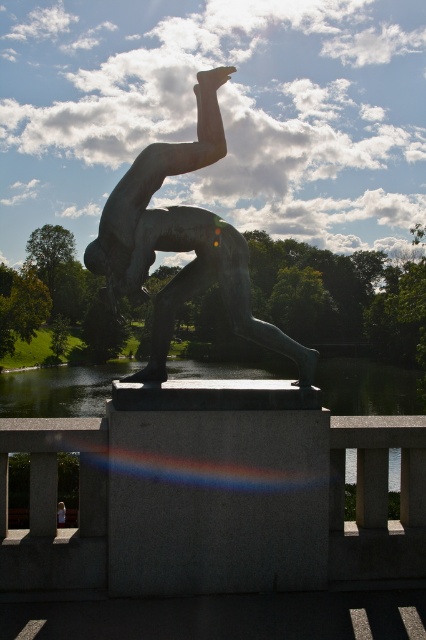
Question: Does bronze statue at center have a smaller size compared to transparent glass water at center?

Choices:
 (A) no
 (B) yes

Answer: (B)

Question: Which object appears closest to the camera in this image?

Choices:
 (A) bronze statue at center
 (B) transparent glass water at center

Answer: (A)

Question: Among these points, which one is nearest to the camera?

Choices:
 (A) (123, 364)
 (B) (196, 84)

Answer: (B)

Question: Can you confirm if bronze statue at center is positioned above transparent glass water at center?

Choices:
 (A) yes
 (B) no

Answer: (A)

Question: From the image, what is the correct spatial relationship of bronze statue at center in relation to transparent glass water at center?

Choices:
 (A) right
 (B) left

Answer: (A)